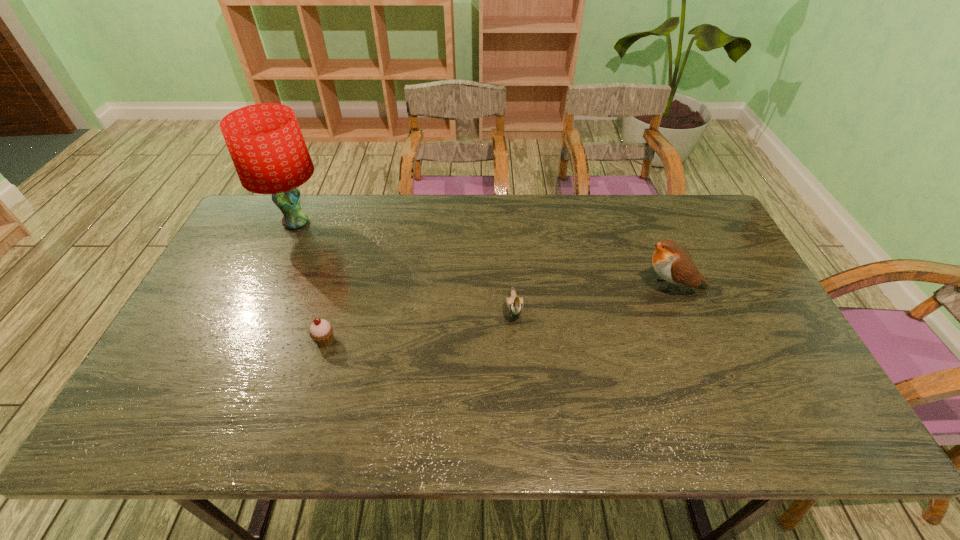
This screenshot has width=960, height=540. Find the location of `free space between the left bird and the third object from right to left`. free space between the left bird and the third object from right to left is located at coordinates (420, 324).

Locate an element on the screen. vacant space in between the taller bird and the shortest object is located at coordinates (498, 313).

Image resolution: width=960 pixels, height=540 pixels. In order to click on vacant space in between the lampshade and the shorter bird in this screenshot , I will do `click(405, 265)`.

Where is `vacant space that's between the rightmost object and the shorter bird`? This screenshot has height=540, width=960. vacant space that's between the rightmost object and the shorter bird is located at coordinates (592, 297).

Image resolution: width=960 pixels, height=540 pixels. In order to click on vacant area between the farthest object and the second object from right to left in this screenshot , I will do `click(405, 265)`.

Locate an element on the screen. Image resolution: width=960 pixels, height=540 pixels. object that is the second closest to the lampshade is located at coordinates (514, 304).

Identify which object is the nearest to the right bird. Please provide its 2D coordinates. Your answer should be formatted as a tuple, i.e. [(x, y)], where the tuple contains the x and y coordinates of a point satisfying the conditions above.

[(514, 304)]

The width and height of the screenshot is (960, 540). Find the location of `vacant area that satisfies the following two spatial constraints: 1. at the face of the right bird; 2. at the face of the shorter bird`. vacant area that satisfies the following two spatial constraints: 1. at the face of the right bird; 2. at the face of the shorter bird is located at coordinates (681, 308).

This screenshot has height=540, width=960. I want to click on vacant space that satisfies the following two spatial constraints: 1. on the front-facing side of the lampshade; 2. on the left side of the third object from right to left, so click(x=243, y=340).